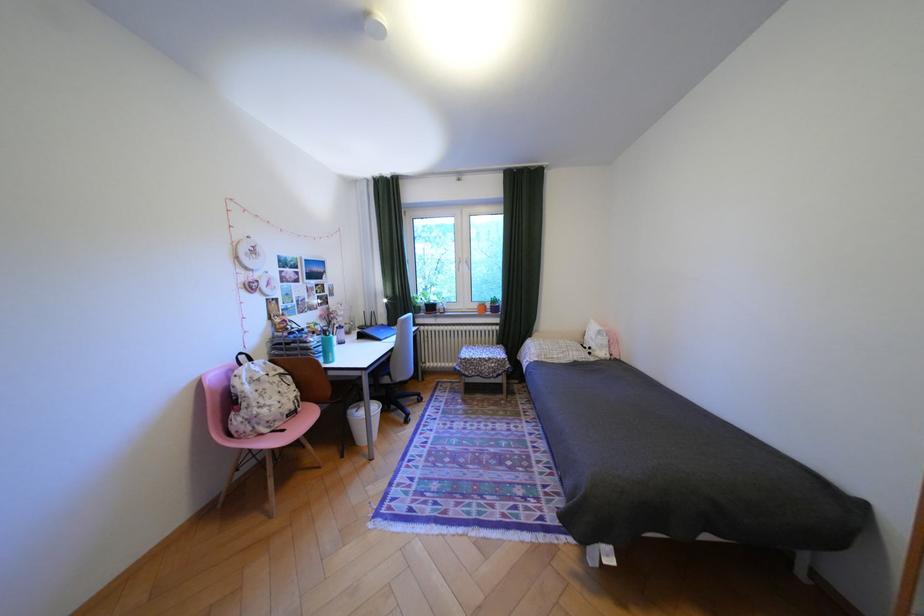
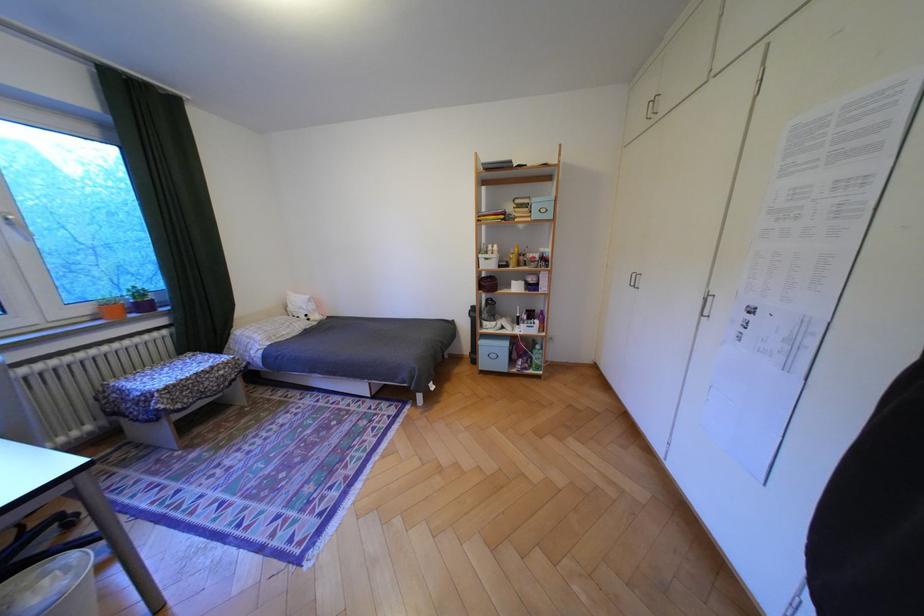
Find the pixel in the second image that matches point 477,265 in the first image.

(18, 227)